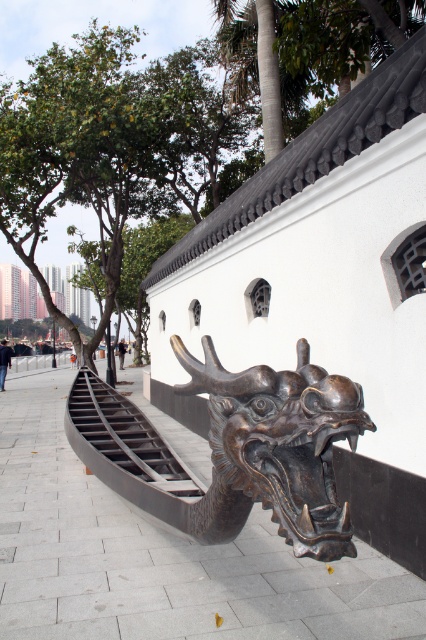
Question: Is bronze/sculpture at center in front of black matte stair at lower left?

Choices:
 (A) yes
 (B) no

Answer: (A)

Question: Among these objects, which one is nearest to the camera?

Choices:
 (A) bronze/sculpture at center
 (B) green leafy tree at upper left

Answer: (A)

Question: Which of these objects is positioned closest to the bronze/sculpture at center?

Choices:
 (A) green leafy tree at upper left
 (B) black matte stair at lower left

Answer: (B)

Question: Is green leafy tree at upper left below black matte stair at lower left?

Choices:
 (A) no
 (B) yes

Answer: (A)

Question: Considering the real-world distances, which object is closest to the black matte stair at lower left?

Choices:
 (A) bronze/sculpture at center
 (B) green leafy tree at upper left

Answer: (A)

Question: Does bronze/sculpture at center come in front of green leafy tree at upper left?

Choices:
 (A) yes
 (B) no

Answer: (A)